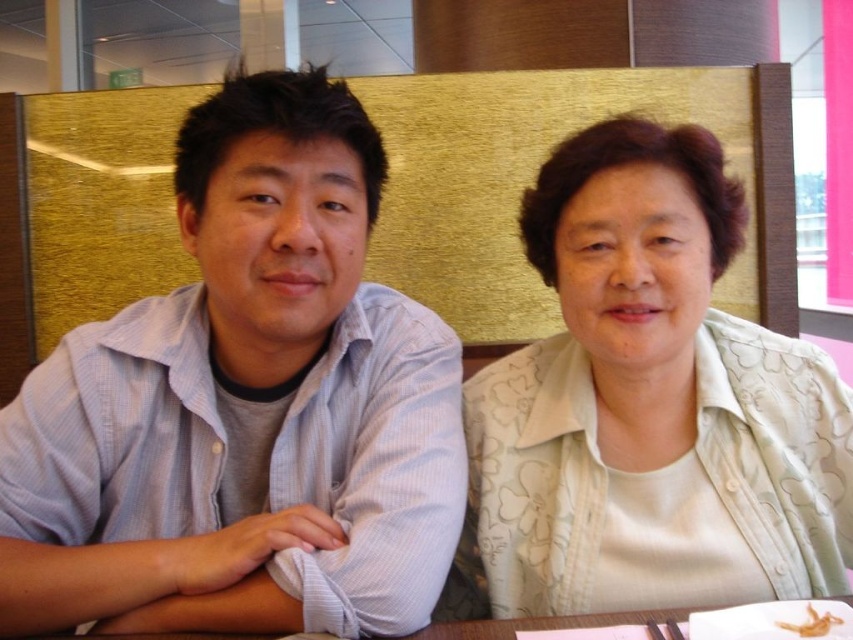
Question: Estimate the real-world distances between objects in this image. Which object is farther from the light blue striped shirt at left?

Choices:
 (A) translucent yellow shrimp at lower right
 (B) light green floral blouse at center

Answer: (A)

Question: Which object appears farthest from the camera in this image?

Choices:
 (A) translucent yellow shrimp at lower right
 (B) light green floral blouse at center

Answer: (B)

Question: Considering the relative positions of light green floral blouse at center and translucent yellow shrimp at lower right in the image provided, where is light green floral blouse at center located with respect to translucent yellow shrimp at lower right?

Choices:
 (A) below
 (B) above

Answer: (B)

Question: Based on their relative distances, which object is nearer to the light blue striped shirt at left?

Choices:
 (A) translucent yellow shrimp at lower right
 (B) light green floral blouse at center

Answer: (B)

Question: Is the position of light blue striped shirt at left less distant than that of light green floral blouse at center?

Choices:
 (A) yes
 (B) no

Answer: (A)

Question: Is light blue striped shirt at left smaller than translucent yellow shrimp at lower right?

Choices:
 (A) no
 (B) yes

Answer: (A)